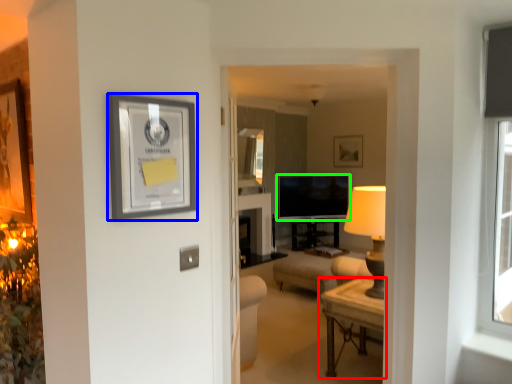
Question: Which is farther away from table (highlighted by a red box)? picture frame (highlighted by a blue box) or television (highlighted by a green box)?

Choices:
 (A) picture frame
 (B) television

Answer: (B)